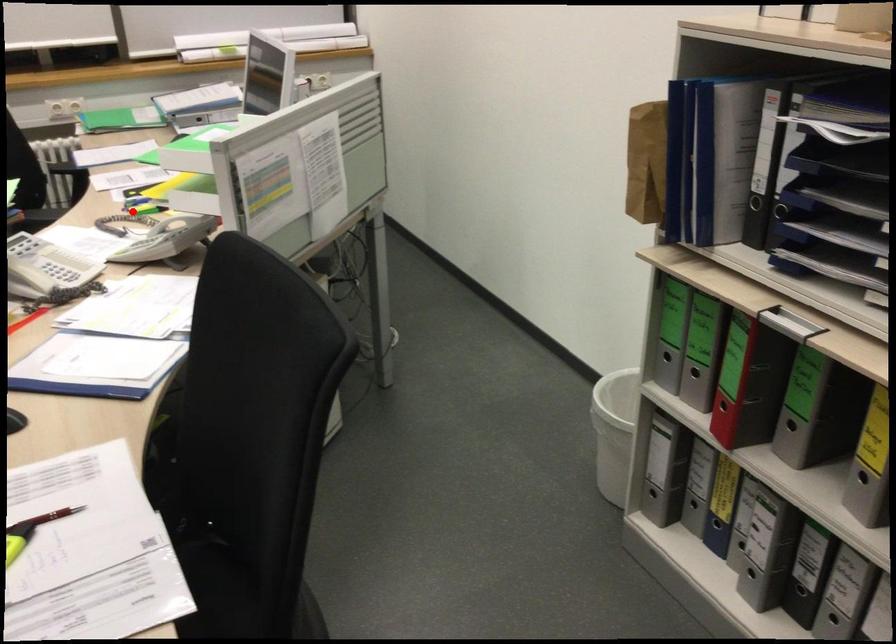
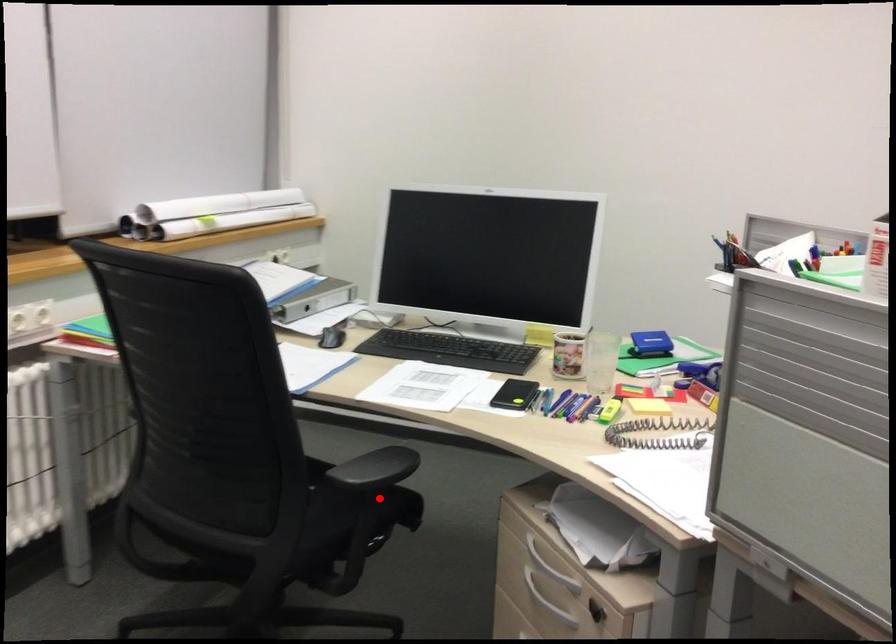
I am providing you with two images of the same scene from different viewpoints. A red point is marked on the first image and another point is marked on the second image. Are the points marked in image1 and image2 representing the same 3D position?

No